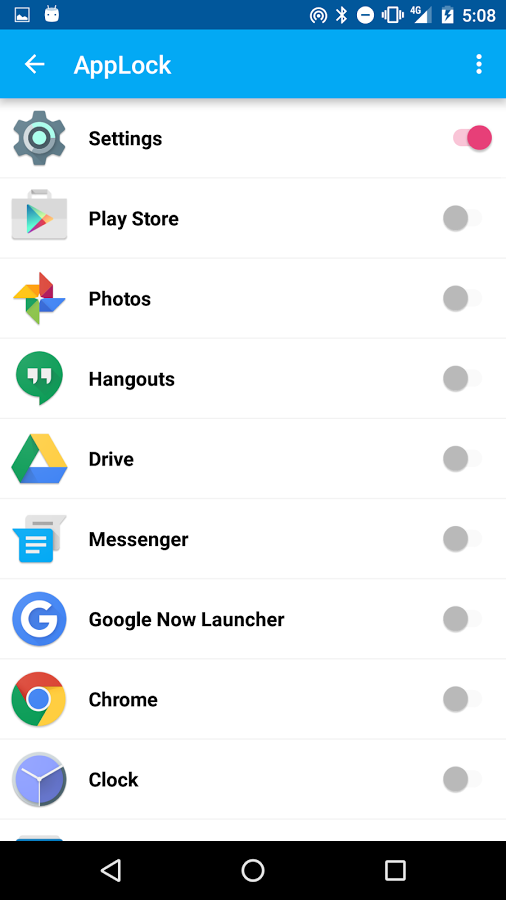
This screenshot has width=506, height=900. Find the location of `toggleable switches switched off`. toggleable switches switched off is located at coordinates (455, 779), (459, 703), (453, 624), (459, 544), (459, 460), (460, 375), (458, 302), (460, 226).